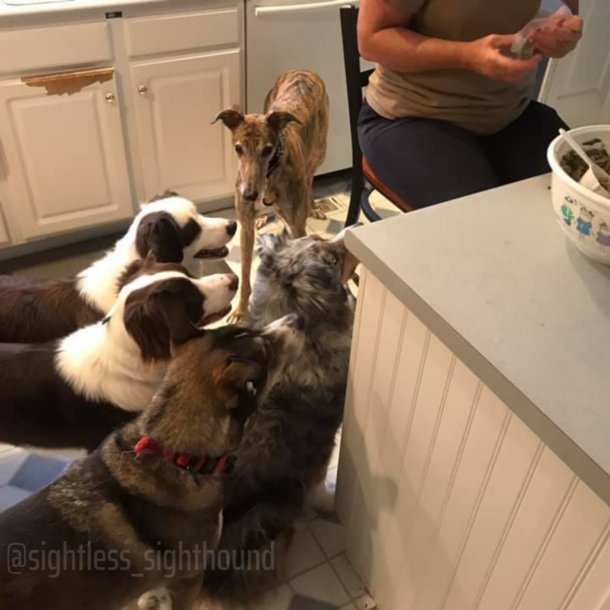
Find the location of a particular element. This screenshot has width=610, height=610. black rectangle cabinet label is located at coordinates [485, 454], [112, 13].